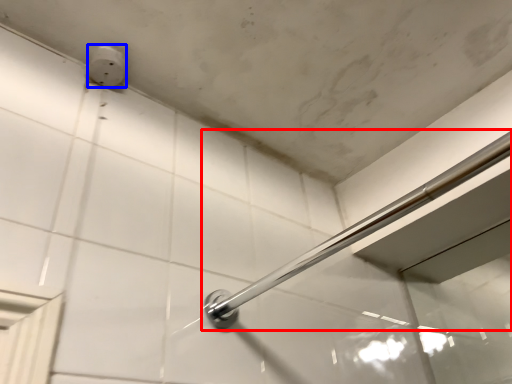
Question: Which point is further to the camera, door handle (highlighted by a red box) or electric outlet (highlighted by a blue box)?

Choices:
 (A) door handle
 (B) electric outlet

Answer: (B)